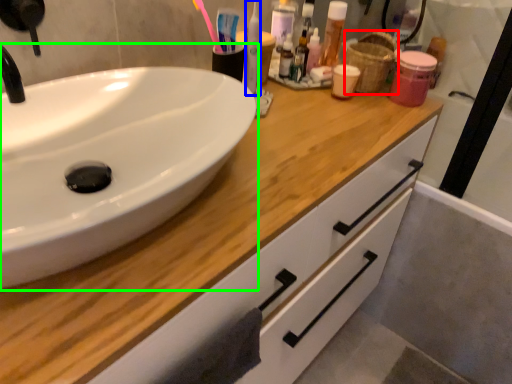
Question: Considering the real-world distances, which object is farthest from basket (highlighted by a red box)? mouthwash (highlighted by a blue box) or sink (highlighted by a green box)?

Choices:
 (A) mouthwash
 (B) sink

Answer: (B)